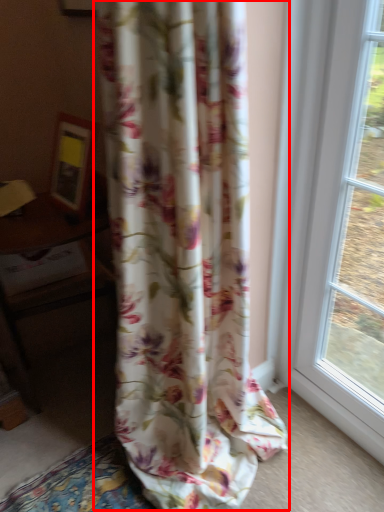
Question: Where is curtain (annotated by the red box) located in relation to table in the image?

Choices:
 (A) left
 (B) right

Answer: (B)